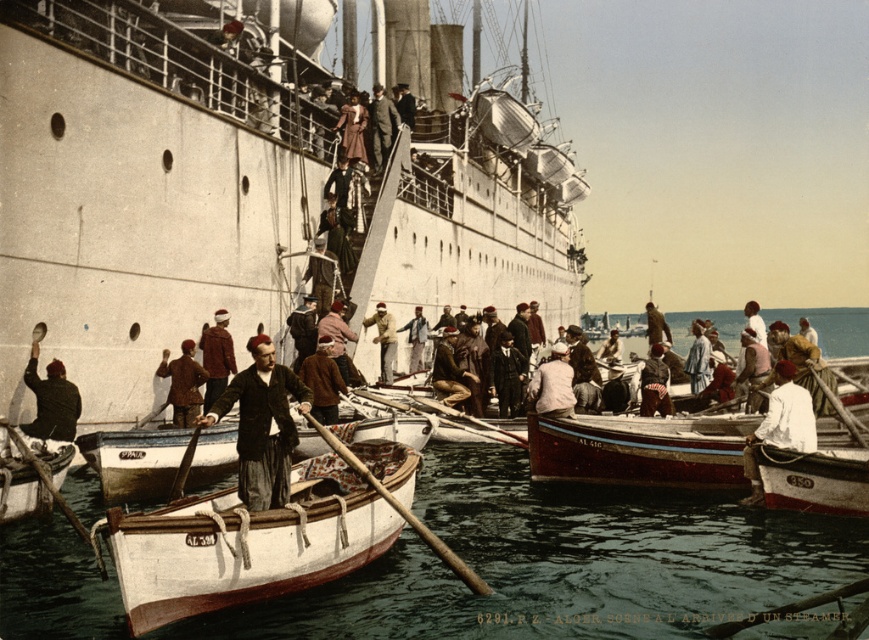
Question: Which of these objects is positioned farthest from the dark brown leather jacket at center?

Choices:
 (A) white wood boat at lower left
 (B) white wooden boat at lower left
 (C) clear blue water at center
 (D) khaki fabric jacket at center

Answer: (D)

Question: Does white matte cruise ship at center have a lesser width compared to dark brown leather jacket at center?

Choices:
 (A) yes
 (B) no

Answer: (B)

Question: Can you confirm if white cotton shirt at center is wider than khaki fabric jacket at center?

Choices:
 (A) yes
 (B) no

Answer: (A)

Question: Among these points, which one is nearest to the camera?

Choices:
 (A) (156, 372)
 (B) (760, 433)
 (C) (381, 380)
 (D) (352, 118)

Answer: (B)

Question: Which point is closer to the camera?

Choices:
 (A) (355, 99)
 (B) (182, 388)
 (C) (383, 161)

Answer: (B)

Question: Does white matte cruise ship at center have a larger size compared to white wooden boat at lower left?

Choices:
 (A) yes
 (B) no

Answer: (A)